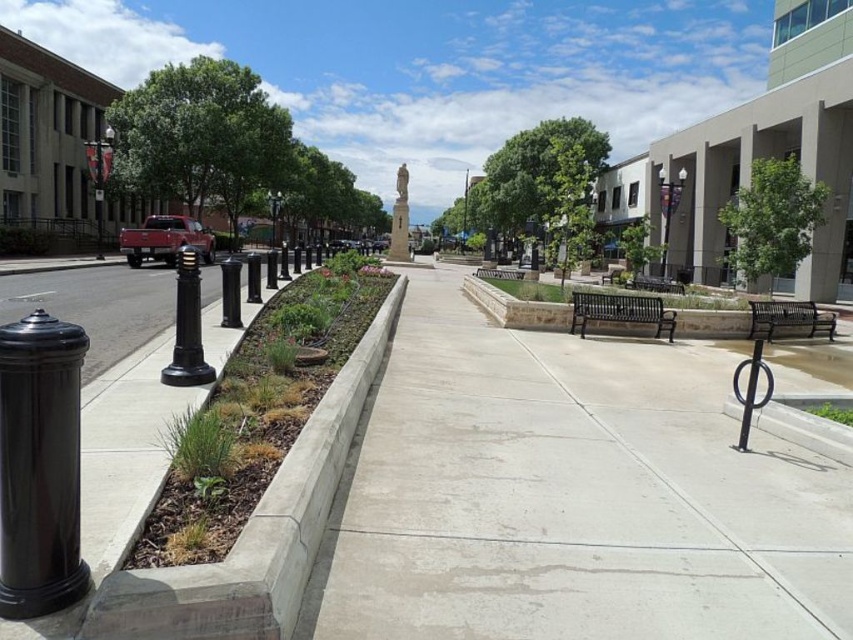
Where is `concrete at left`? concrete at left is located at coordinates (256, 531).

Looking at this image, is concrete at left above black polished pillar at left?

Actually, concrete at left is below black polished pillar at left.

Locate an element on the screen. concrete at left is located at coordinates (256, 531).

Does metallic silver lamp post at upper right have a larger size compared to black polished metal post at center-left?

Actually, metallic silver lamp post at upper right might be smaller than black polished metal post at center-left.

Between point (660, 195) and point (239, 323), which one is positioned behind?

Point (660, 195)

The width and height of the screenshot is (853, 640). What are the coordinates of `metallic silver lamp post at upper right` in the screenshot? It's located at (668, 208).

Can you confirm if concrete at left is thinner than stone statue at center?

Yes, concrete at left is thinner than stone statue at center.

Does concrete at left appear on the left side of stone statue at center?

Incorrect, concrete at left is not on the left side of stone statue at center.

Is point (271, 515) farther from camera compared to point (399, 236)?

No, it is in front of (399, 236).

Identify the location of concrete at left. (256, 531).